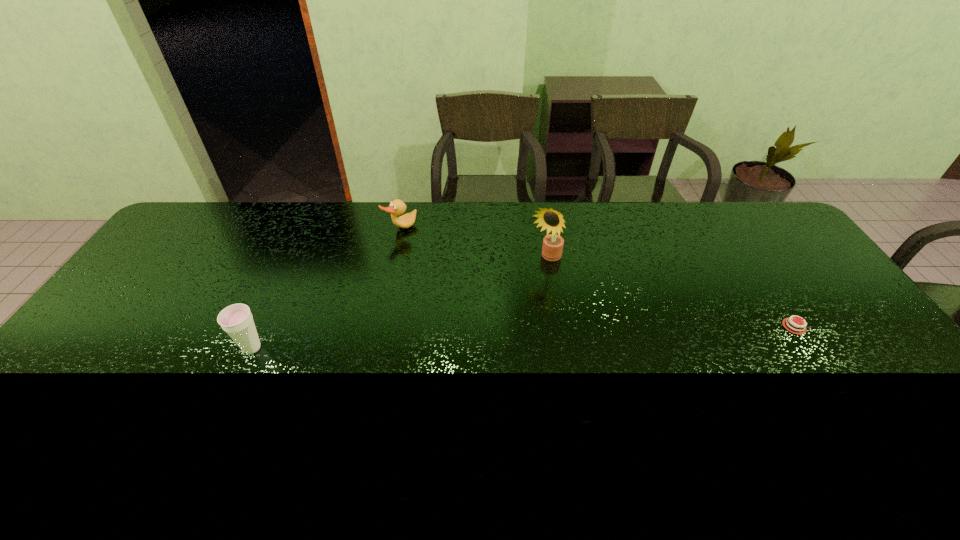
Identify the location of free point between the leftmost object and the chocolate cake. The height and width of the screenshot is (540, 960). (523, 337).

Find the location of a particular element. The image size is (960, 540). free spot between the leftmost object and the tallest object is located at coordinates (398, 303).

The image size is (960, 540). I want to click on object that stands as the closest to the tallest object, so click(397, 207).

Find the location of a particular element. This screenshot has height=540, width=960. object that stands as the second closest to the second farthest object is located at coordinates (793, 326).

At what (x,y) coordinates should I click in order to perform the action: click on free location that satisfies the following two spatial constraints: 1. on the front side of the rightmost object; 2. on the left side of the farthest object. Please return your answer as a coordinate pair (x, y). Looking at the image, I should click on (380, 327).

The image size is (960, 540). Find the location of `vacant space that satisfies the following two spatial constraints: 1. on the back side of the chocolate cake; 2. on the right side of the cup`. vacant space that satisfies the following two spatial constraints: 1. on the back side of the chocolate cake; 2. on the right side of the cup is located at coordinates (262, 327).